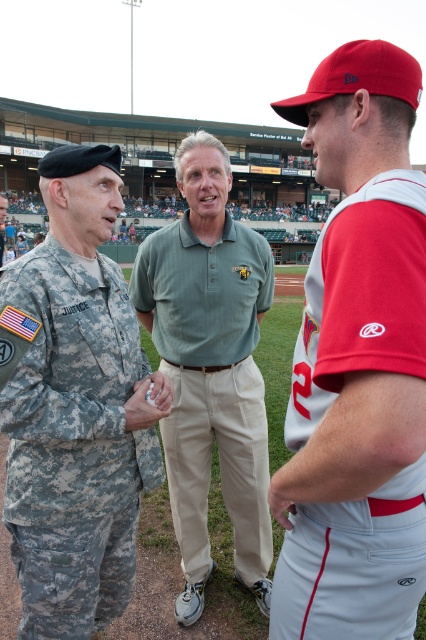
Is camouflage uniform at left positioned behind green cotton polo shirt at center?

No, it is in front of green cotton polo shirt at center.

Which is behind, point (144, 442) or point (187, 321)?

The point (187, 321) is behind.

Where is `camouflage uniform at left`? Image resolution: width=426 pixels, height=640 pixels. camouflage uniform at left is located at coordinates (77, 410).

The width and height of the screenshot is (426, 640). In order to click on red fabric baseball cap at upper right in this screenshot , I will do `click(356, 364)`.

Who is more distant from viewer, (310, 340) or (97, 321)?

Point (97, 321)

What are the coordinates of `red fabric baseball cap at upper right` in the screenshot? It's located at (356, 364).

Is red fabric baseball cap at upper right bigger than green cotton polo shirt at center?

Yes.

Does point (310, 497) come behind point (227, 237)?

No.

What do you see at coordinates (356, 364) in the screenshot? I see `red fabric baseball cap at upper right` at bounding box center [356, 364].

The height and width of the screenshot is (640, 426). I want to click on red fabric baseball cap at upper right, so click(356, 364).